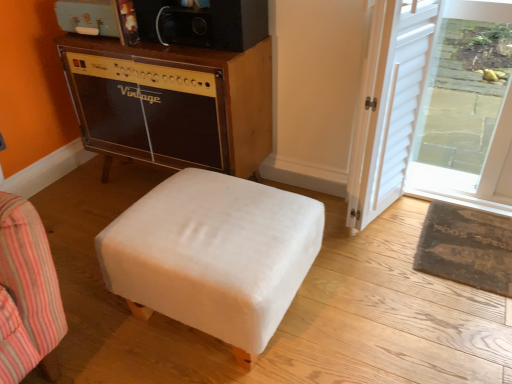
Where is `white wood screen door at right`? This screenshot has width=512, height=384. white wood screen door at right is located at coordinates (390, 106).

This screenshot has height=384, width=512. Identify the location of transparent glass door at upper right. [x=468, y=106].

Where is `white velvety ottoman at center`? This screenshot has width=512, height=384. white velvety ottoman at center is located at coordinates (213, 255).

Can you confirm if white wood screen door at right is taller than rustic brown mat at lower right?

Yes, white wood screen door at right is taller than rustic brown mat at lower right.

Is rustic brown mat at lower right at the back of white wood screen door at right?

No.

Who is more distant, white wood screen door at right or rustic brown mat at lower right?

rustic brown mat at lower right.

Which of these two, white wood screen door at right or rustic brown mat at lower right, is thinner?

With smaller width is white wood screen door at right.

Is rustic brown mat at lower right at the back of white velvety ottoman at center?

No, white velvety ottoman at center is not facing the opposite direction of rustic brown mat at lower right.

In the image, there is a white velvety ottoman at center. Where is `mat above it (from the image's perspective)`? Image resolution: width=512 pixels, height=384 pixels. mat above it (from the image's perspective) is located at coordinates (466, 247).

From the image's perspective, is white velvety ottoman at center above or below rustic brown mat at lower right?

Based on their image positions, white velvety ottoman at center is located beneath rustic brown mat at lower right.

From a real-world perspective, is white velvety ottoman at center beneath rusty metal suitcase at upper left?

Yes.

Which point is more distant from viewer, (316,229) or (109,14)?

Point (109,14)

Find the location of `appliance above the white velvety ottoman at center (from the image's perspective)`. appliance above the white velvety ottoman at center (from the image's perspective) is located at coordinates (87, 17).

Is white velvety ottoman at center with rusty metal suitcase at upper left?

No, white velvety ottoman at center is not next to rusty metal suitcase at upper left.

Is transparent glass door at upper right thinner than rustic brown mat at lower right?

Indeed, transparent glass door at upper right has a lesser width compared to rustic brown mat at lower right.

Who is bigger, transparent glass door at upper right or rustic brown mat at lower right?

With larger size is transparent glass door at upper right.

Consider the image. Which of these two, transparent glass door at upper right or rustic brown mat at lower right, stands taller?

With more height is transparent glass door at upper right.

In the scene shown: Based on their positions, is transparent glass door at upper right located to the left or right of rustic brown mat at lower right?

In the image, transparent glass door at upper right appears on the right side of rustic brown mat at lower right.

Are white velvety ottoman at center and vintage wood amplifier at upper left making contact?

No, white velvety ottoman at center is not next to vintage wood amplifier at upper left.

Consider the image. From a real-world perspective, is white velvety ottoman at center positioned above or below vintage wood amplifier at upper left?

In terms of real-world spatial position, white velvety ottoman at center is below vintage wood amplifier at upper left.

Is white velvety ottoman at center aimed at vintage wood amplifier at upper left?

No, white velvety ottoman at center is not facing towards vintage wood amplifier at upper left.

Can you confirm if white velvety ottoman at center is taller than vintage wood amplifier at upper left?

No.

In terms of height, does rusty metal suitcase at upper left look taller or shorter compared to white wood screen door at right?

Clearly, rusty metal suitcase at upper left is shorter compared to white wood screen door at right.

Between rusty metal suitcase at upper left and white wood screen door at right, which one appears on the right side from the viewer's perspective?

Positioned to the right is white wood screen door at right.

From a real-world perspective, which is physically below, rusty metal suitcase at upper left or white wood screen door at right?

In real-world perspective, white wood screen door at right is lower.

Is white wood screen door at right surrounding rusty metal suitcase at upper left?

Definitely not — rusty metal suitcase at upper left is not inside white wood screen door at right.

Is white wood screen door at right bigger than rusty metal suitcase at upper left?

Yes.

Is white wood screen door at right closer to camera compared to rusty metal suitcase at upper left?

Yes, the depth of white wood screen door at right is less than that of rusty metal suitcase at upper left.

Locate an element on the screen. This screenshot has height=384, width=512. mat to the right of white wood screen door at right is located at coordinates (466, 247).

Locate an element on the screen. This screenshot has width=512, height=384. furniture below the rustic brown mat at lower right (from the image's perspective) is located at coordinates (213, 255).

Which object lies nearer to the anchor point vintage wood amplifier at upper left, white wood screen door at right or white velvety ottoman at center?

white velvety ottoman at center lies closer to vintage wood amplifier at upper left than the other object.

Estimate the real-world distances between objects in this image. Which object is closer to rustic brown mat at lower right, rusty metal suitcase at upper left or white wood screen door at right?

white wood screen door at right is positioned closer to the anchor rustic brown mat at lower right.

Estimate the real-world distances between objects in this image. Which object is further from white wood screen door at right, rustic brown mat at lower right or transparent glass door at upper right?

Based on the image, rustic brown mat at lower right appears to be further to white wood screen door at right.

When comparing their distances from white velvety ottoman at center, does white wood screen door at right or rusty metal suitcase at upper left seem closer?

The object closer to white velvety ottoman at center is white wood screen door at right.

When comparing their distances from white velvety ottoman at center, does rusty metal suitcase at upper left or rustic brown mat at lower right seem further?

rusty metal suitcase at upper left.

From the image, which object appears to be farther from white wood screen door at right, transparent glass door at upper right or rusty metal suitcase at upper left?

rusty metal suitcase at upper left lies further to white wood screen door at right than the other object.

Looking at this image, when comparing their distances from white velvety ottoman at center, does rustic brown mat at lower right or rusty metal suitcase at upper left seem closer?

rustic brown mat at lower right lies closer to white velvety ottoman at center than the other object.

Considering their positions, is transparent glass door at upper right positioned closer to white velvety ottoman at center than vintage wood amplifier at upper left?

vintage wood amplifier at upper left.

Locate an element on the screen. The height and width of the screenshot is (384, 512). table between rusty metal suitcase at upper left and transparent glass door at upper right from left to right is located at coordinates (172, 103).

Where is `screen door located between white velvety ottoman at center and rustic brown mat at lower right in the left-right direction`? screen door located between white velvety ottoman at center and rustic brown mat at lower right in the left-right direction is located at coordinates (390, 106).

Locate an element on the screen. The height and width of the screenshot is (384, 512). screen door situated between white velvety ottoman at center and transparent glass door at upper right from left to right is located at coordinates 390,106.

Identify the location of screen door situated between vintage wood amplifier at upper left and rustic brown mat at lower right from left to right. This screenshot has width=512, height=384. (390, 106).